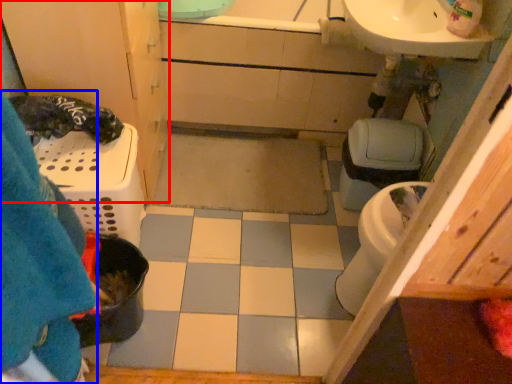
Question: Which object appears farthest to the camera in this image, bathroom cabinet (highlighted by a red box) or blanket (highlighted by a blue box)?

Choices:
 (A) bathroom cabinet
 (B) blanket

Answer: (A)